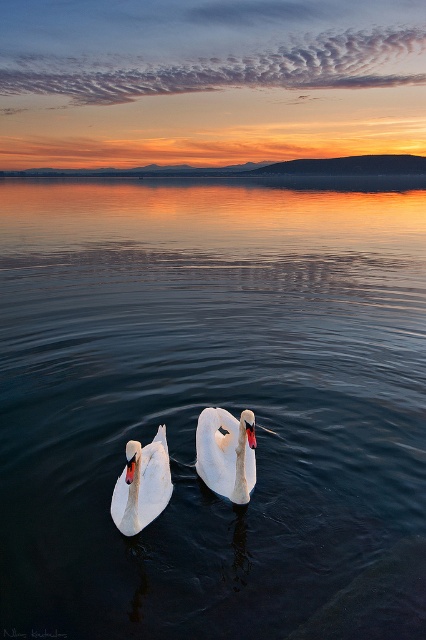
Does smooth dark water at center appear under white glossy swan at center?

Incorrect, smooth dark water at center is not positioned below white glossy swan at center.

Which of these two, smooth dark water at center or white glossy swan at center, stands shorter?

white glossy swan at center is shorter.

Which is behind, point (11, 433) or point (230, 467)?

Positioned behind is point (11, 433).

The image size is (426, 640). Identify the location of smooth dark water at center. (213, 404).

From the picture: Which is more to the right, smooth dark water at center or white glossy swan at lower left?

white glossy swan at lower left is more to the right.

Is smooth dark water at center further to camera compared to white glossy swan at lower left?

That is True.

Identify the location of smooth dark water at center. The height and width of the screenshot is (640, 426). (213, 404).

Is white glossy swan at center shorter than white glossy swan at lower left?

Incorrect, white glossy swan at center's height does not fall short of white glossy swan at lower left's.

Who is positioned more to the right, white glossy swan at center or white glossy swan at lower left?

white glossy swan at center

Between point (213, 435) and point (135, 496), which one is positioned in front?

Point (135, 496) is in front.

In order to click on white glossy swan at center in this screenshot , I will do `click(227, 452)`.